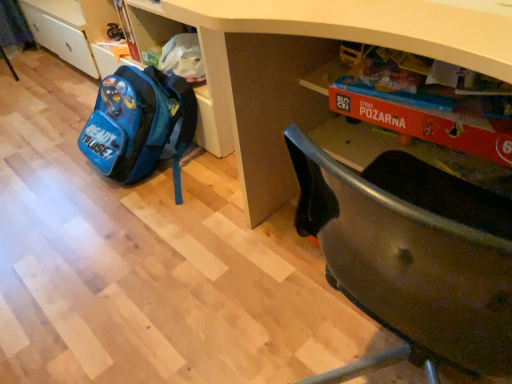
What are the coordinates of `vacant location below blue fabric backpack at lower left (from a real-world perspective)` in the screenshot? It's located at (168, 173).